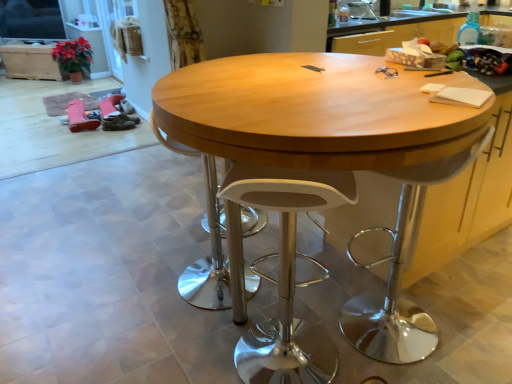
Find the location of a particular element. empty space that is to the right of white plastic swivel chair at right, which is counted as the 2th swivel chair, starting from the left is located at coordinates (462, 322).